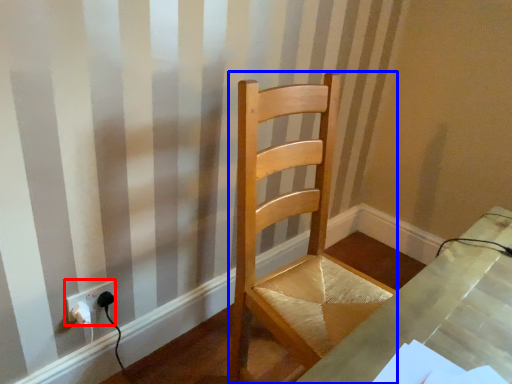
Question: Which object appears closest to the camera in this image, electric outlet (highlighted by a red box) or chair (highlighted by a blue box)?

Choices:
 (A) electric outlet
 (B) chair

Answer: (B)